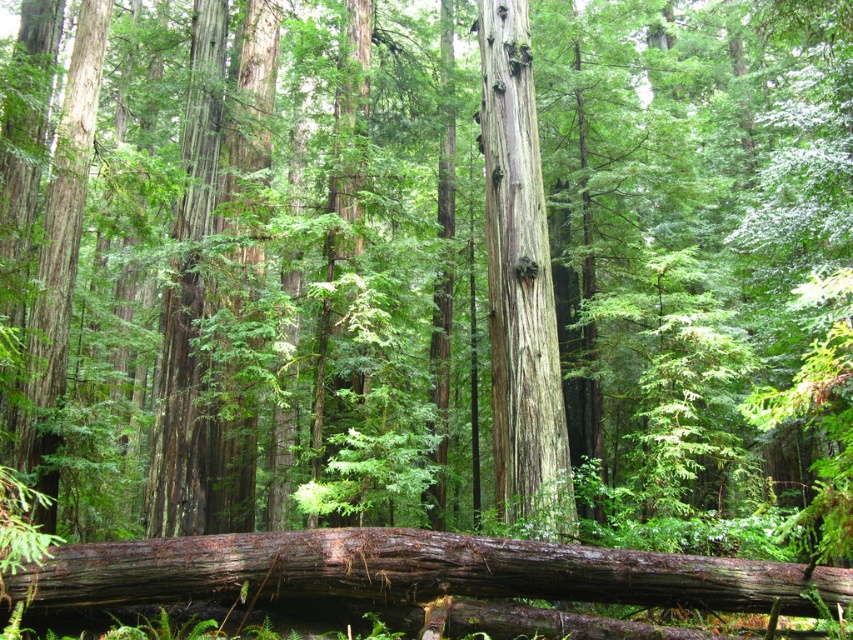
Question: Which point is closer to the camera?

Choices:
 (A) rough bark log at center
 (B) smooth gray bark at center

Answer: (A)

Question: Is rough bark log at center positioned in front of smooth gray bark at center?

Choices:
 (A) yes
 (B) no

Answer: (A)

Question: Which object is farther from the camera taking this photo?

Choices:
 (A) rough bark log at center
 (B) smooth gray bark at center

Answer: (B)

Question: In this image, where is rough bark log at center located relative to smooth gray bark at center?

Choices:
 (A) above
 (B) below

Answer: (A)

Question: Does rough bark log at center have a larger size compared to smooth gray bark at center?

Choices:
 (A) no
 (B) yes

Answer: (B)